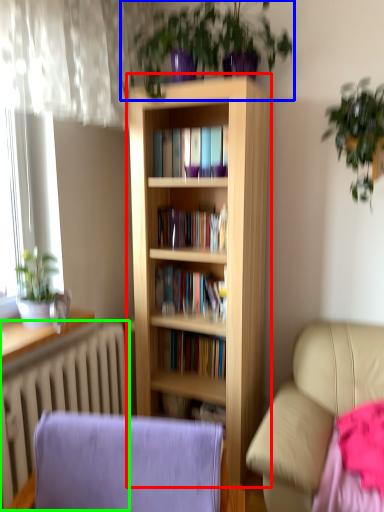
Question: Based on their relative distances, which object is farther from bookcase (highlighted by a red box)? Choose from houseplant (highlighted by a blue box) and radiator (highlighted by a green box).

Choices:
 (A) houseplant
 (B) radiator

Answer: (B)